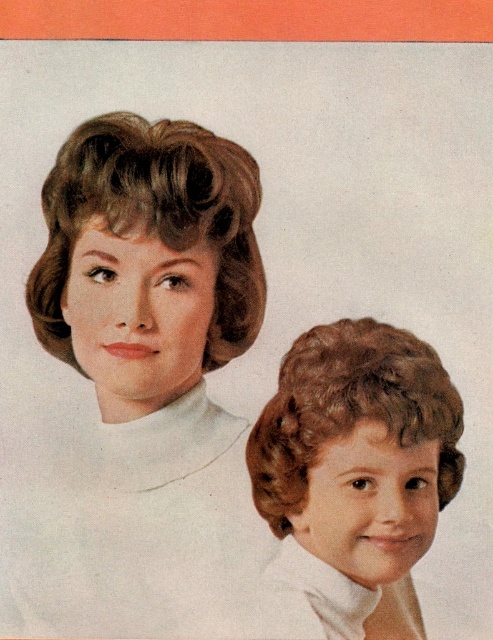
Question: Can you confirm if matte brown hair at upper left is positioned to the right of shiny brown hair at lower right?

Choices:
 (A) yes
 (B) no

Answer: (B)

Question: Is matte brown hair at upper left below shiny brown hair at lower right?

Choices:
 (A) yes
 (B) no

Answer: (B)

Question: Among these points, which one is nearest to the camera?

Choices:
 (A) (351, 394)
 (B) (66, 310)

Answer: (A)

Question: Is matte brown hair at upper left to the right of shiny brown hair at lower right from the viewer's perspective?

Choices:
 (A) yes
 (B) no

Answer: (B)

Question: Which object is farther from the camera taking this photo?

Choices:
 (A) shiny brown hair at lower right
 (B) matte brown hair at upper left

Answer: (B)

Question: Which object appears farthest from the camera in this image?

Choices:
 (A) matte brown hair at upper left
 (B) shiny brown hair at lower right

Answer: (A)